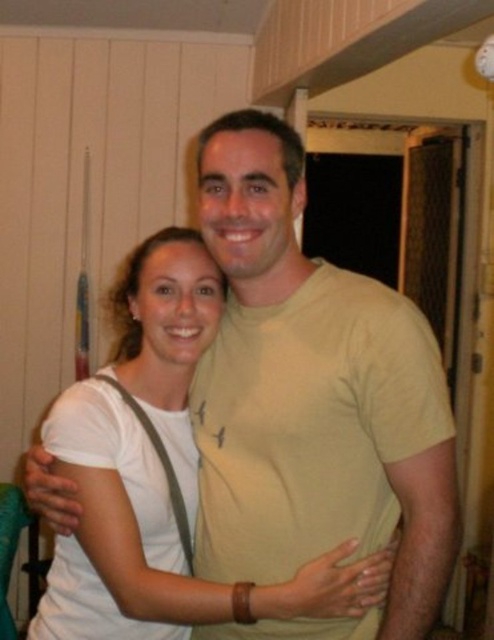
Question: Does light beige t-shirt at center come in front of white matte shirt at center?

Choices:
 (A) no
 (B) yes

Answer: (B)

Question: In this image, where is light beige t-shirt at center located relative to white matte shirt at center?

Choices:
 (A) right
 (B) left

Answer: (A)

Question: Does light beige t-shirt at center appear on the left side of white matte shirt at center?

Choices:
 (A) no
 (B) yes

Answer: (A)

Question: Which of the following is the farthest from the observer?

Choices:
 (A) (91, 426)
 (B) (328, 349)

Answer: (A)

Question: Which point is farther from the camera taking this photo?

Choices:
 (A) (222, 486)
 (B) (150, 342)

Answer: (B)

Question: Which point is farther from the camera taking this photo?

Choices:
 (A) click(138, 312)
 (B) click(217, 518)

Answer: (A)